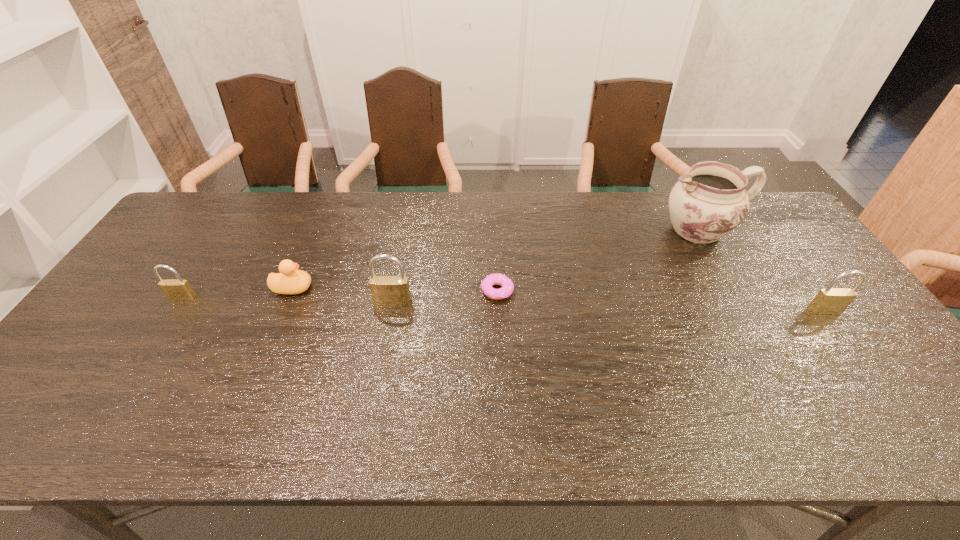
The height and width of the screenshot is (540, 960). I want to click on the fifth object from right to left, so click(x=290, y=281).

I want to click on free space located on the front-facing side of the shortest padlock, so click(168, 320).

Where is `free space located on the front-facing side of the second padlock from right to left`? free space located on the front-facing side of the second padlock from right to left is located at coordinates (383, 352).

The image size is (960, 540). Identify the location of vacant area situated 0.250m on the front-facing side of the third tallest object. tap(888, 398).

Where is `vacant position located 0.230m on the spout of the tallest object`? vacant position located 0.230m on the spout of the tallest object is located at coordinates (587, 230).

At what (x,y) coordinates should I click in order to perform the action: click on vacant space located 0.400m on the spout of the tallest object. Please return your answer as a coordinate pair (x, y). Looking at the image, I should click on click(535, 230).

You are a GUI agent. You are given a task and a screenshot of the screen. Output one action in this format:
    pyautogui.click(x=<x>, y=<y>)
    Task: Click on the vacant space located on the spout of the tallest object
    The width and height of the screenshot is (960, 540).
    Given the screenshot: What is the action you would take?
    pyautogui.click(x=639, y=230)

This screenshot has height=540, width=960. What are the coordinates of `free region located 0.250m on the left of the shortest object` in the screenshot? It's located at (393, 291).

This screenshot has height=540, width=960. In order to click on free space located on the face of the fifth object from right to left in this screenshot , I will do `click(350, 288)`.

Identify the location of object at the far edge. (705, 205).